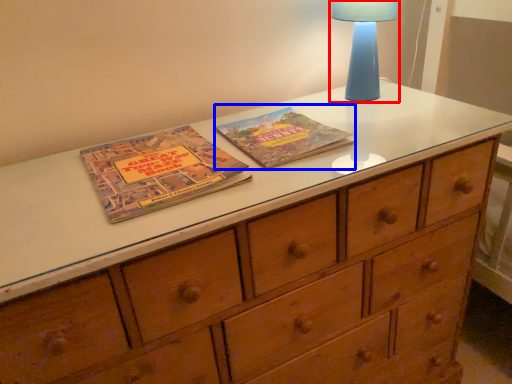
Question: Which of the following is the closest to the observer, bedside lamp (highlighted by a red box) or paperback book (highlighted by a blue box)?

Choices:
 (A) bedside lamp
 (B) paperback book

Answer: (B)